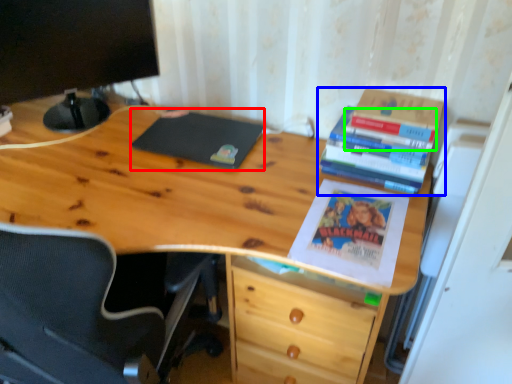
Question: Based on their relative distances, which object is farther from notebook (highlighted by a red box)? Choose from book (highlighted by a blue box) and book (highlighted by a green box).

Choices:
 (A) book
 (B) book

Answer: (B)